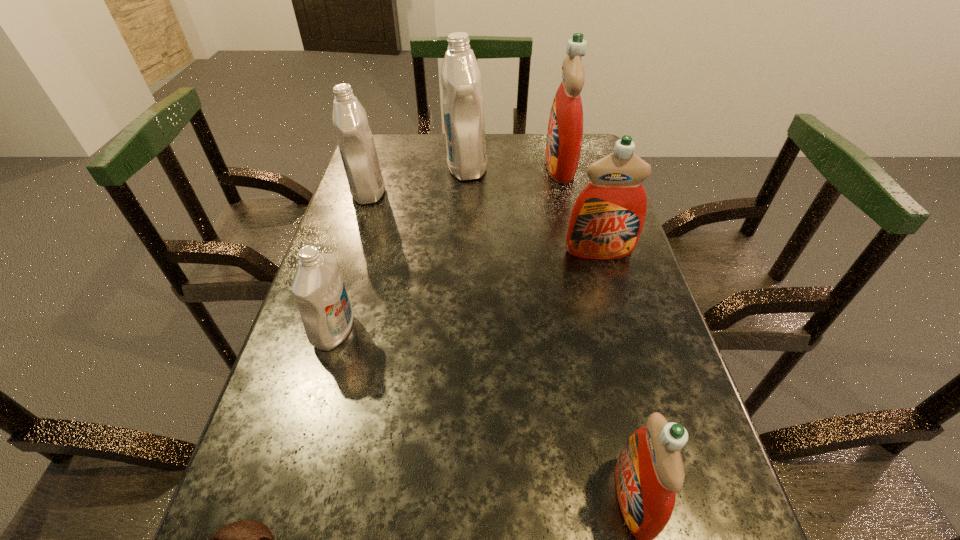
Identify the location of free space located 0.190m on the front surface of the farthest red detergent. Image resolution: width=960 pixels, height=540 pixels. (482, 167).

At what (x,y) coordinates should I click in order to perform the action: click on free space located 0.080m on the front surface of the farthest red detergent. Please return your answer as a coordinate pair (x, y). The width and height of the screenshot is (960, 540). Looking at the image, I should click on (518, 167).

Where is `vacant space located on the front of the second biggest white detergent`? vacant space located on the front of the second biggest white detergent is located at coordinates (358, 224).

Find the location of a particular element. Image resolution: width=960 pixels, height=540 pixels. vacant space located 0.270m on the front surface of the third nearest detergent is located at coordinates point(630,356).

This screenshot has height=540, width=960. In order to click on vacant space located 0.250m on the right of the second nearest detergent in this screenshot , I will do `click(475, 332)`.

The height and width of the screenshot is (540, 960). I want to click on object that is at the far right corner, so click(x=565, y=129).

In the image, there is a desktop. Identify the location of vacant space at the far edge. This screenshot has height=540, width=960. (431, 133).

I want to click on free space at the left edge of the desktop, so click(x=356, y=376).

This screenshot has width=960, height=540. I want to click on vacant space at the right edge of the desktop, so click(572, 194).

This screenshot has width=960, height=540. Find the location of `vacant space at the far left corner`. vacant space at the far left corner is located at coordinates (411, 138).